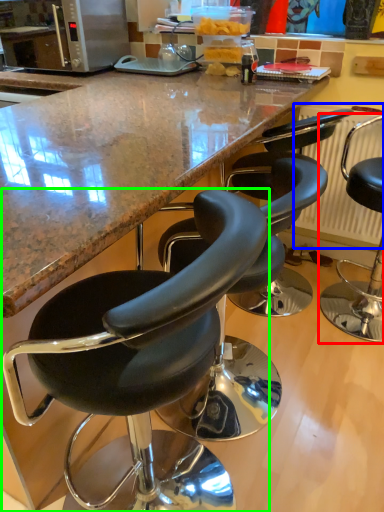
Question: Which object is the closest to the chair (highlighted by a red box)? Choose among these: radiator (highlighted by a blue box) or chair (highlighted by a green box).

Choices:
 (A) radiator
 (B) chair

Answer: (A)